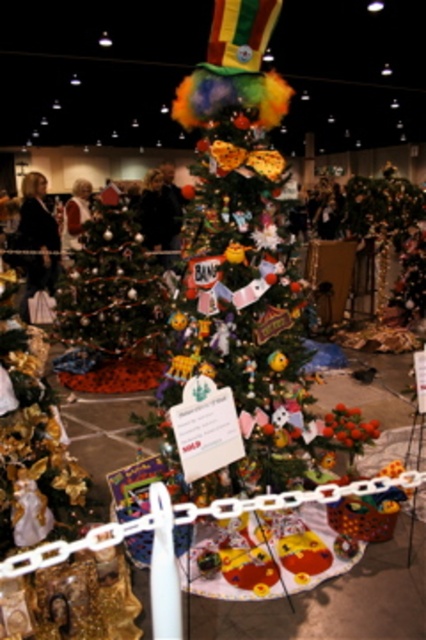
You are standing in front of a festive Christmas tree and want to know how far the point at coordinates point (141, 280) is from your current position. Can you determine the distance?

The point (141, 280) is 5.09 meters away from the camera, so the distance from your current position to the point is 5.09 meters.

You are standing in the festive indoor setting and want to place a gift under the green matte Christmas tree at left. Where should you place the gift relative to the tree?

The green matte Christmas tree at left is located at point (109, 289), so you should place the gift under the tree at that coordinate.